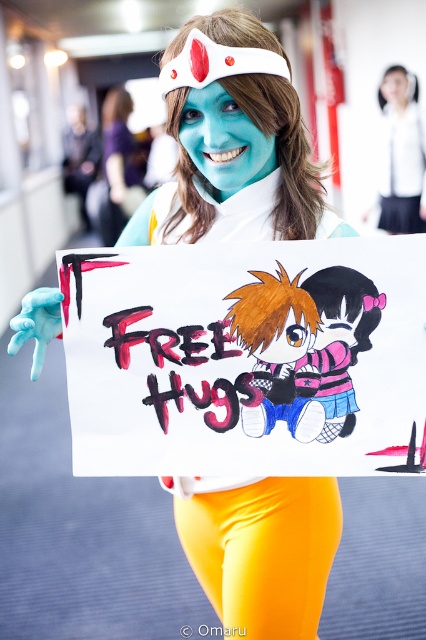
You are standing in the hallway where the person with the FREE HUGS sign is holding the pastel pink fabric plush at center. If you want to grab the plush without moving closer, can you reach it?

The pastel pink fabric plush at center is 39.08 inches away from viewer, so yes, you can reach it without moving closer.

You are organizing a cosplay event and need to ensure that all props and accessories fit within a standard display case that is 1 meter wide. You have a pastel pink fabric plush at center and a matte white headband at upper center. Which item will require more space horizontally?

The pastel pink fabric plush at center requires more horizontal space because its width is larger than the matte white headband at upper center.